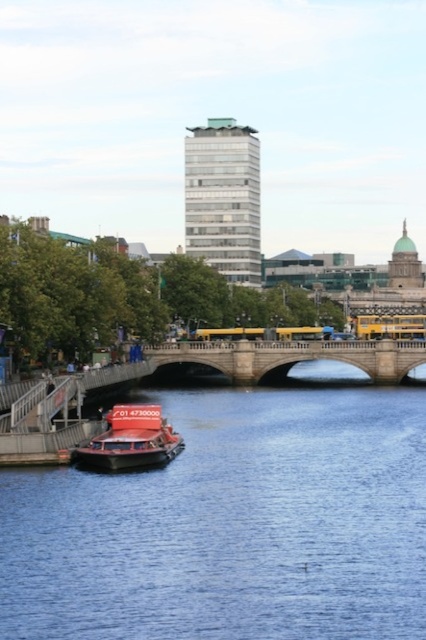
Question: Does blue water at center have a smaller size compared to stone bridge at center?

Choices:
 (A) yes
 (B) no

Answer: (B)

Question: Can you confirm if stone bridge at center is bigger than shiny red boat at lower left?

Choices:
 (A) no
 (B) yes

Answer: (B)

Question: Which point is closer to the camera?

Choices:
 (A) yellow metallic bus at center
 (B) shiny red boat at lower left
 (C) stone bridge at center
 (D) blue water at center

Answer: (D)

Question: Which point is closer to the camera taking this photo?

Choices:
 (A) (316, 353)
 (B) (186, 570)
 (C) (400, 317)

Answer: (B)

Question: Is the position of blue water at center less distant than that of yellow metallic bus at center?

Choices:
 (A) yes
 (B) no

Answer: (A)

Question: Estimate the real-world distances between objects in this image. Which object is closer to the shiny red boat at lower left?

Choices:
 (A) stone bridge at center
 (B) blue water at center

Answer: (B)